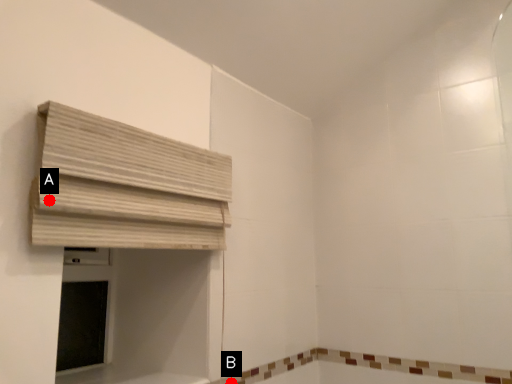
Question: Two points are circled on the image, labeled by A and B beside each circle. Which point is further to the camera?

Choices:
 (A) A is further
 (B) B is further

Answer: (B)